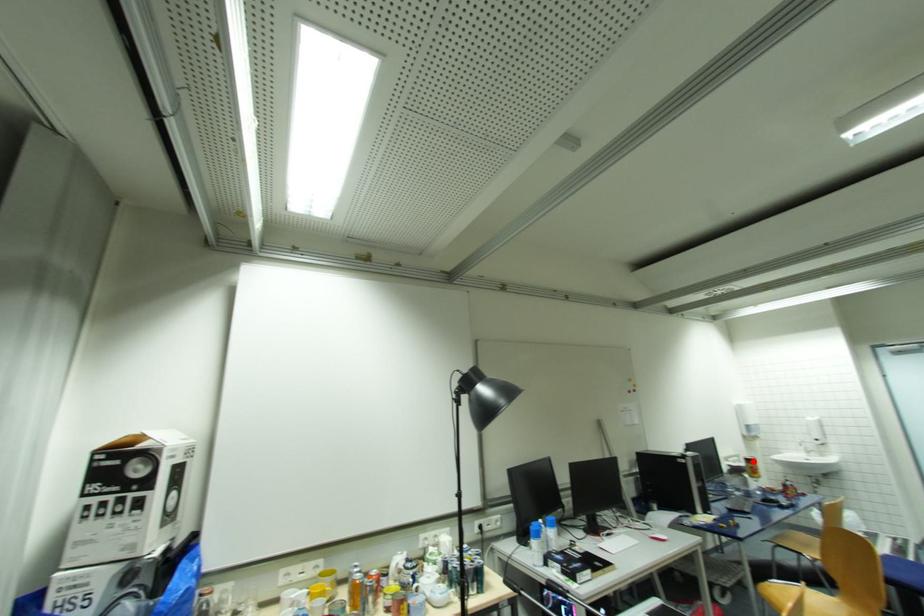
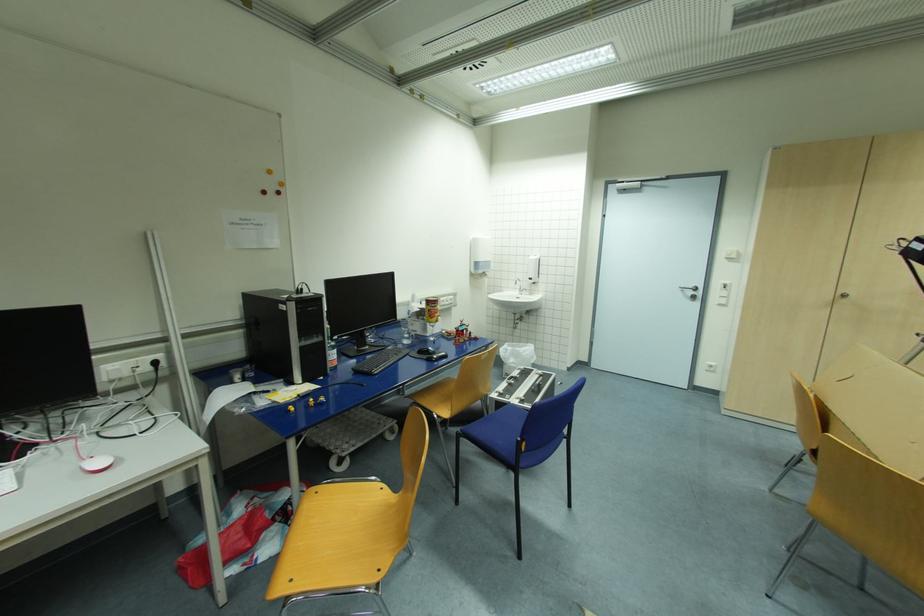
Question: I am providing you with two images of the same scene from different viewpoints. In image1, a red point is highlighted. Considering the same 3D point in image2, which of the following is correct?

Choices:
 (A) It is closer
 (B) It is farther

Answer: (A)